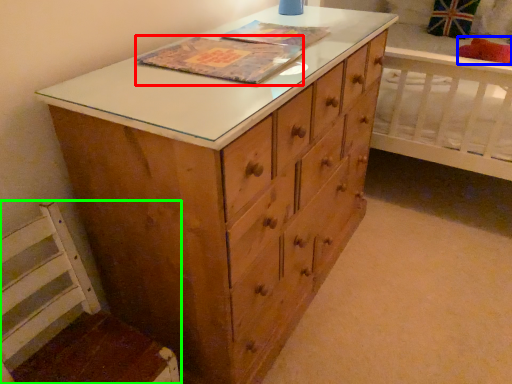
Question: Estimate the real-world distances between objects in this image. Which object is farther from book cover (highlighted by a red box), pillow (highlighted by a blue box) or swivel chair (highlighted by a green box)?

Choices:
 (A) pillow
 (B) swivel chair

Answer: (A)